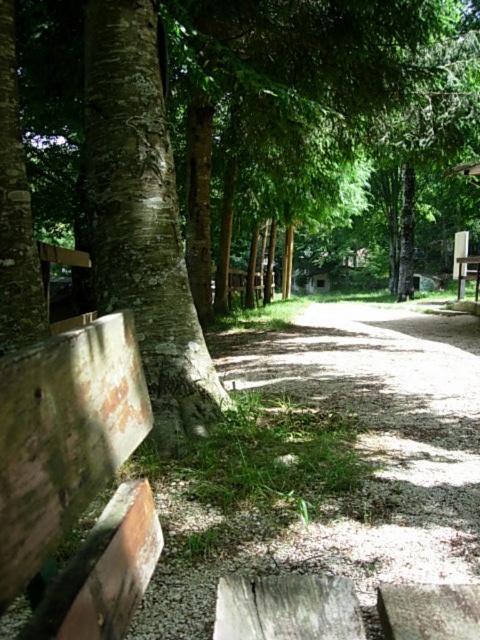
Question: Which of the following is the farthest from the observer?

Choices:
 (A) rough bark tree at left
 (B) rusty wood bench at lower left
 (C) gravel path at center
 (D) wooden picnic table at center

Answer: (D)

Question: Which point is farther to the camera?

Choices:
 (A) rusty wood bench at lower left
 (B) wooden picnic table at center
 (C) rough bark tree at left
 (D) gravel path at center

Answer: (B)

Question: Is gravel path at center below rusty wood bench at lower left?

Choices:
 (A) no
 (B) yes

Answer: (B)

Question: Which point is closer to the camera?

Choices:
 (A) rusty wood bench at lower left
 (B) wooden picnic table at center
 (C) gravel path at center
 (D) rough bark tree at left

Answer: (A)

Question: Is the position of gravel path at center more distant than that of rusty wood bench at lower left?

Choices:
 (A) no
 (B) yes

Answer: (B)

Question: Can you confirm if gravel path at center is bigger than rusty wood bench at lower left?

Choices:
 (A) yes
 (B) no

Answer: (A)